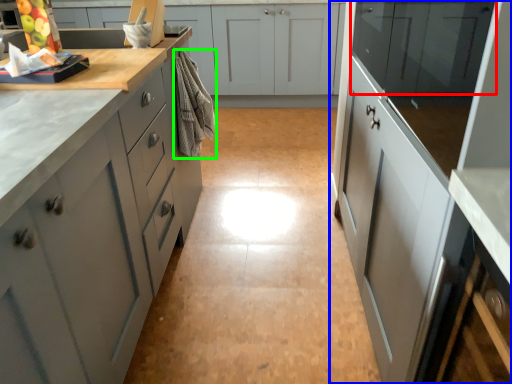
Question: Based on their relative distances, which object is nearer to cabinetry (highlighted by a red box)? Choose from cabinetry (highlighted by a blue box) and material (highlighted by a green box).

Choices:
 (A) cabinetry
 (B) material

Answer: (A)